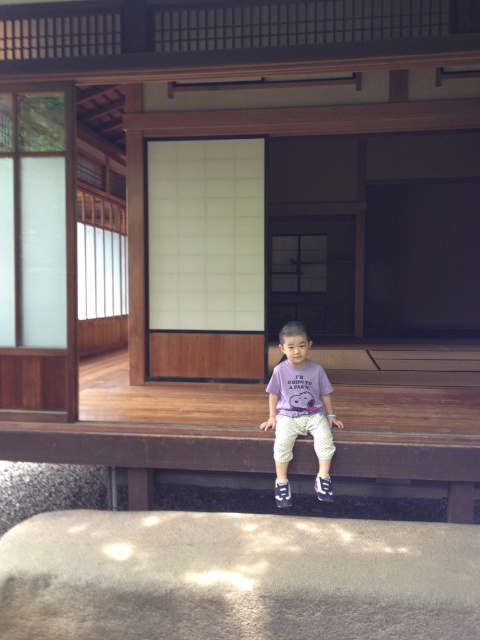
From the picture: You are a parent trying to place a small toy on the brown wooden ledge at lower center. The toy is the same width as the purple cotton shirt at center. Will the toy fit on the ledge?

The brown wooden ledge at lower center is wider than the purple cotton shirt at center, so the toy, which has the same width as the purple cotton shirt at center, will fit on the ledge.

You are a parent trying to ensure your child stays safe while playing on the wooden platform. The brown wooden ledge at lower center and the purple cotton shirt at center are in the scene. Which object is shorter and could potentially pose a safety hazard if the child leans over it?

The brown wooden ledge at lower center is shorter than the purple cotton shirt at center, which means the ledge is lower and could pose a safety hazard if the child leans over it.

You are standing at the point labeled point (286, 365) and want to move to the point labeled point (6, 433). Based on the scene description, which direction should you move to reach your destination?

To reach point (6, 433) from point (286, 365), you should move downward because point (6, 433) is positioned below point (286, 365).